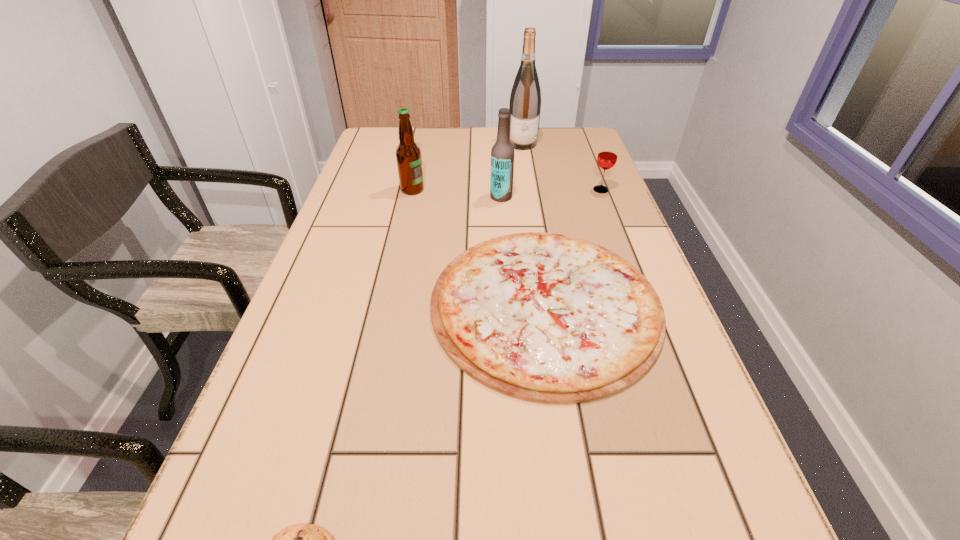
Where is `free space at the right edge of the desktop`? This screenshot has height=540, width=960. free space at the right edge of the desktop is located at coordinates (642, 252).

Find the location of a particular element. The image size is (960, 540). empty location between the left beer bottle and the farthest object is located at coordinates (468, 167).

I want to click on free space that is in between the pizza and the tallest object, so click(x=534, y=224).

Locate which object ranks in proximity to the cookie. Please provide its 2D coordinates. Your answer should be formatted as a tuple, i.e. [(x, y)], where the tuple contains the x and y coordinates of a point satisfying the conditions above.

[(544, 317)]

At what (x,y) coordinates should I click in order to perform the action: click on object identified as the fourth closest to the second shortest object. Please return your answer as a coordinate pair (x, y). Looking at the image, I should click on [302, 539].

Identify the location of free spot that satisfies the following two spatial constraints: 1. on the label of the right beer bottle; 2. on the left side of the fifth farthest object. (508, 304).

Image resolution: width=960 pixels, height=540 pixels. I want to click on free region that satisfies the following two spatial constraints: 1. on the label of the second shortest object; 2. on the right side of the left beer bottle, so click(x=388, y=304).

Find the location of a particular element. This screenshot has height=540, width=960. free location that satisfies the following two spatial constraints: 1. on the label of the right beer bottle; 2. on the right side of the second shortest object is located at coordinates (508, 304).

Identify the location of free space that satisfies the following two spatial constraints: 1. on the label of the third shortest object; 2. on the left side of the wine bottle. (530, 190).

You are a GUI agent. You are given a task and a screenshot of the screen. Output one action in this format:
    pyautogui.click(x=<x>, y=<y>)
    Task: Click on the vacant point that satisfies the following two spatial constraints: 1. on the label of the left beer bottle; 2. on the back side of the third shortest object
    This screenshot has height=540, width=960.
    Given the screenshot: What is the action you would take?
    pyautogui.click(x=413, y=190)